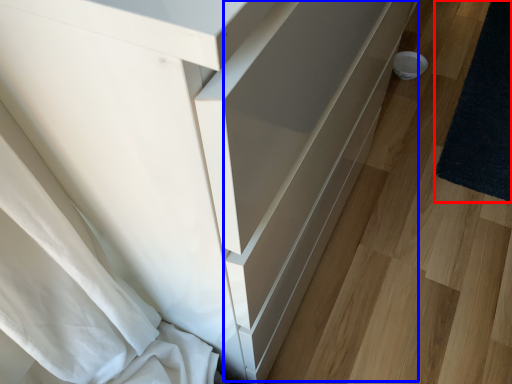
Question: Among these objects, which one is farthest to the camera, mat (highlighted by a red box) or drawer (highlighted by a blue box)?

Choices:
 (A) mat
 (B) drawer

Answer: (A)